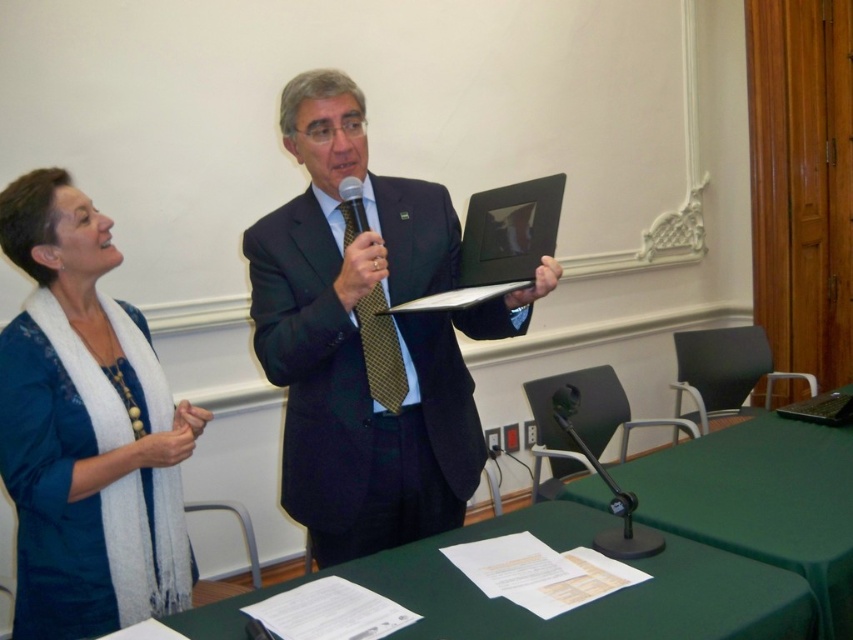
Question: Does green fabric table at lower center appear on the left side of green fabric table at lower right?

Choices:
 (A) yes
 (B) no

Answer: (A)

Question: From the image, what is the correct spatial relationship of matte black suit at center in relation to white knit scarf at upper left?

Choices:
 (A) below
 (B) above

Answer: (B)

Question: Considering the real-world distances, which object is farthest from the gold textured tie at center?

Choices:
 (A) green fabric table at lower center
 (B) white knit scarf at upper left

Answer: (B)

Question: Based on their relative distances, which object is nearer to the gold textured tie at center?

Choices:
 (A) green fabric table at lower center
 (B) white knit scarf at upper left
 (C) matte black suit at center

Answer: (C)

Question: Can you confirm if white knit scarf at upper left is positioned to the left of green fabric table at lower center?

Choices:
 (A) yes
 (B) no

Answer: (A)

Question: Which of the following is the farthest from the observer?

Choices:
 (A) (467, 598)
 (B) (299, 97)
 (C) (115, 497)

Answer: (B)